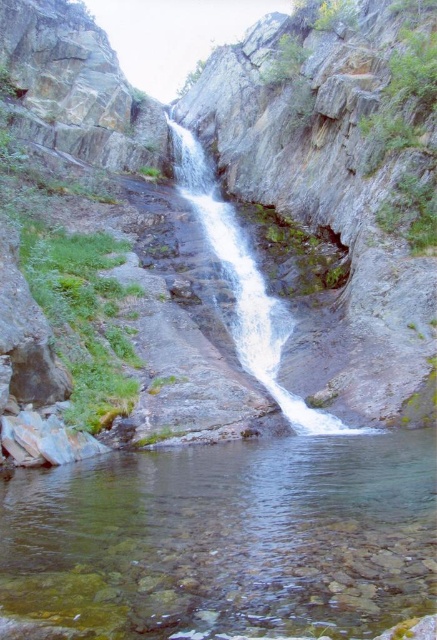
Between clear glass water at center and white frothy water at center, which one appears on the left side from the viewer's perspective?

white frothy water at center is more to the left.

Between point (52, 579) and point (235, 268), which one is positioned behind?

The point (235, 268) is more distant.

Identify the location of clear glass water at center. The width and height of the screenshot is (437, 640). (228, 538).